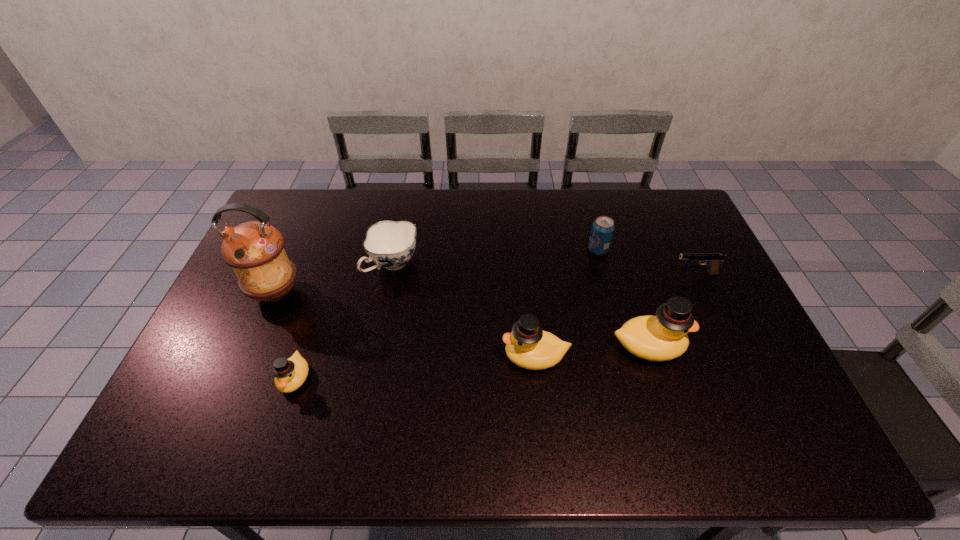
If equal spacing is the goal by inserting an additional duck among them, please point out a vacant space for this new duck. Please provide its 2D coordinates. Your answer should be formatted as a tuple, i.e. [(x, y)], where the tuple contains the x and y coordinates of a point satisfying the conditions above.

[(418, 367)]